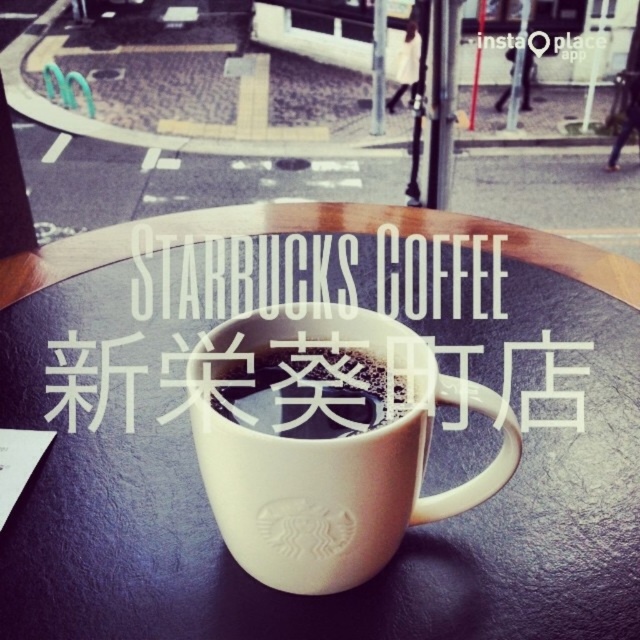
You are standing in front of the white Starbucks coffee cup on the table. A small sticker is placed at the coordinate point (x=324, y=440). Where on the cup is the sticker located?

The point (x=324, y=440) indicates the white ceramic mug at center, so the sticker is located on the center of the white Starbucks coffee cup.

You are a barista setting up a promotional display. You notice the white matte table at center and the white matte text at center in the scene. Which object is located below the other?

The white matte table at center is positioned under the white matte text at center, so the table is below the text.